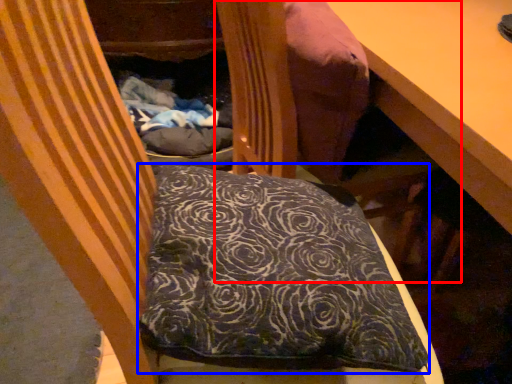
Question: Which point is closer to the camera, bean bag chair (highlighted by a red box) or pillow (highlighted by a blue box)?

Choices:
 (A) bean bag chair
 (B) pillow

Answer: (B)